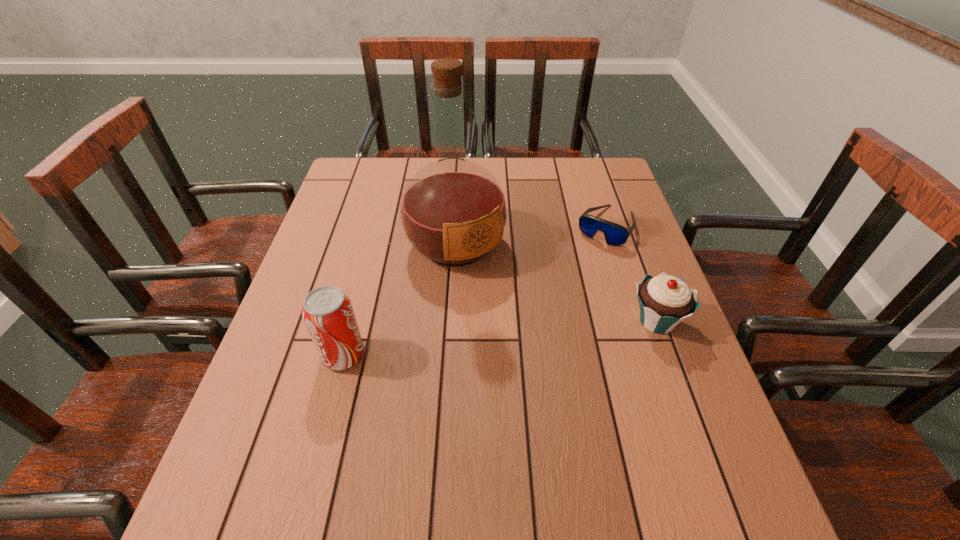
Locate an element on the screen. The height and width of the screenshot is (540, 960). free space on the desktop that is between the third shortest object and the second shortest object and is positioned on the front-facing side of the shortest object is located at coordinates (535, 334).

This screenshot has height=540, width=960. What are the coordinates of `vacant spot on the desktop that is between the second tallest object and the second shortest object and is positioned on the front label of the third object from right to left` in the screenshot? It's located at (524, 335).